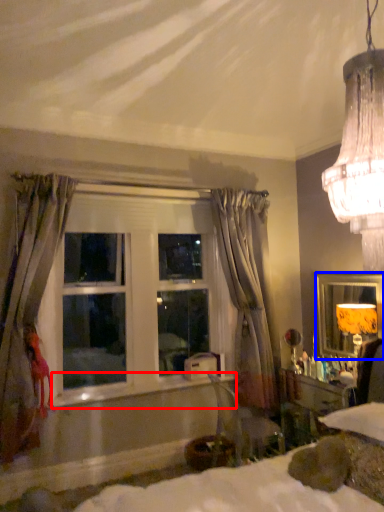
Question: Among these objects, which one is nearest to the camera, window sill (highlighted by a red box) or mirror (highlighted by a blue box)?

Choices:
 (A) window sill
 (B) mirror

Answer: (A)